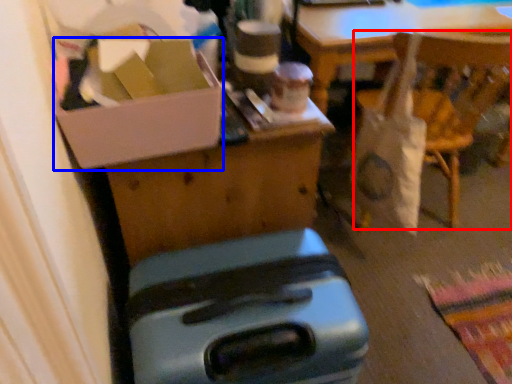
Question: Which object appears farthest to the camera in this image, chair (highlighted by a red box) or box (highlighted by a blue box)?

Choices:
 (A) chair
 (B) box

Answer: (A)